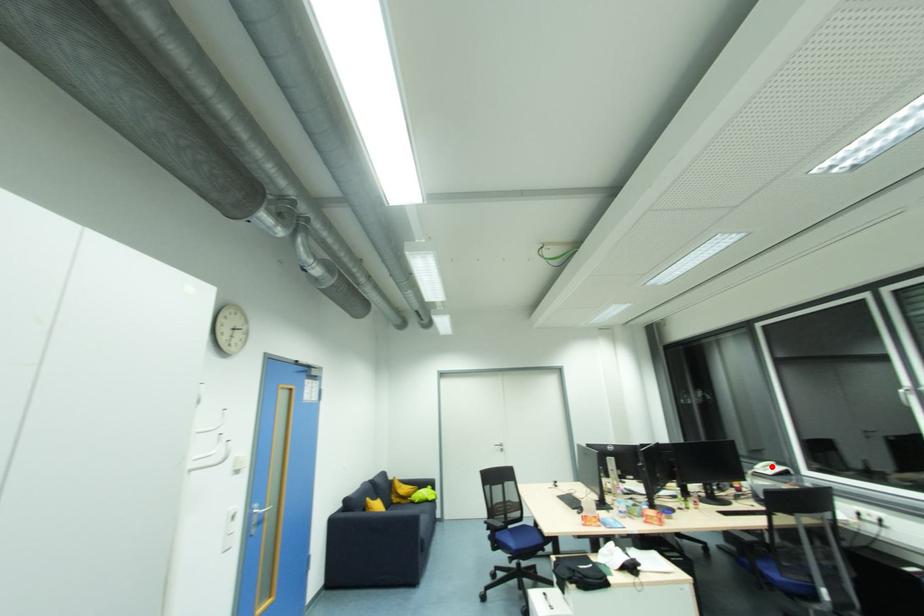
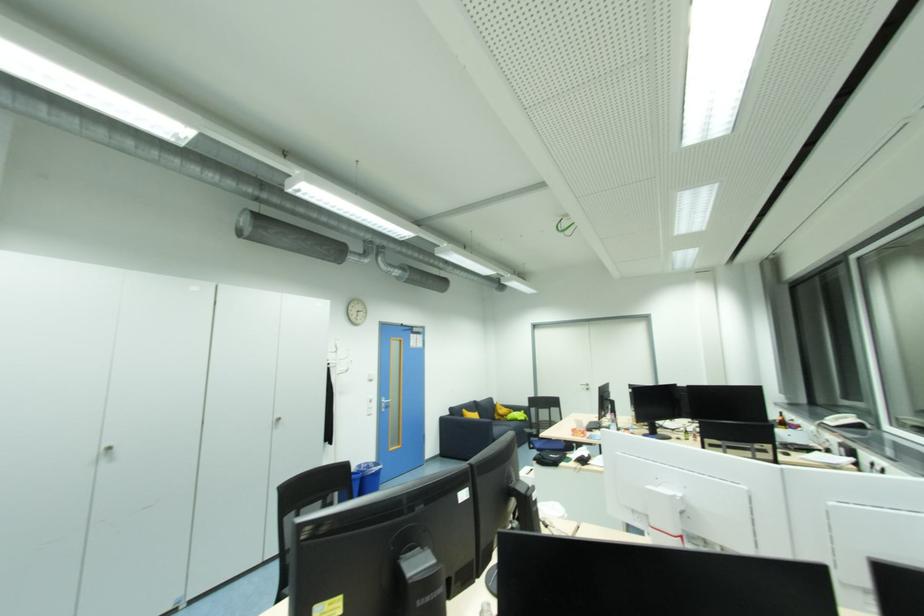
Question: I am providing you with two images of the same scene from different viewpoints. Given a red point in image1, look at the same physical point in image2. Is it:

Choices:
 (A) Closer to the viewpoint
 (B) Farther from the viewpoint

Answer: (B)